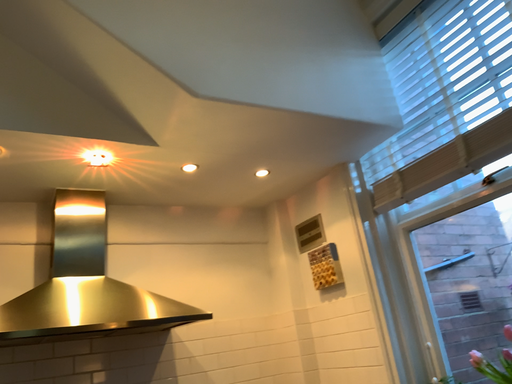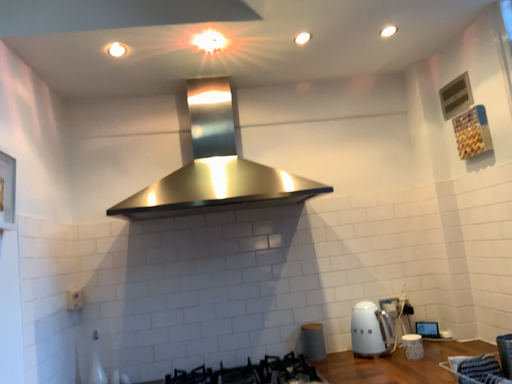
Question: How did the camera likely rotate when shooting the video?

Choices:
 (A) rotated right
 (B) rotated left

Answer: (B)